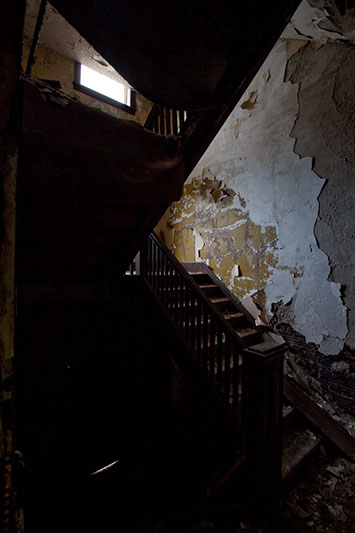
This screenshot has width=355, height=533. In order to click on ceiling in this screenshot , I will do click(56, 32).